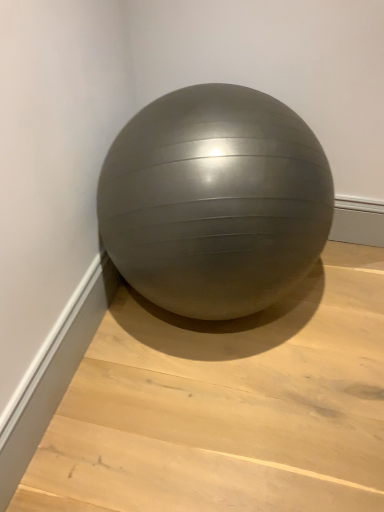
This screenshot has height=512, width=384. In order to click on free spot below matte gray ball at center (from a real-world perspective) in this screenshot , I will do `click(248, 327)`.